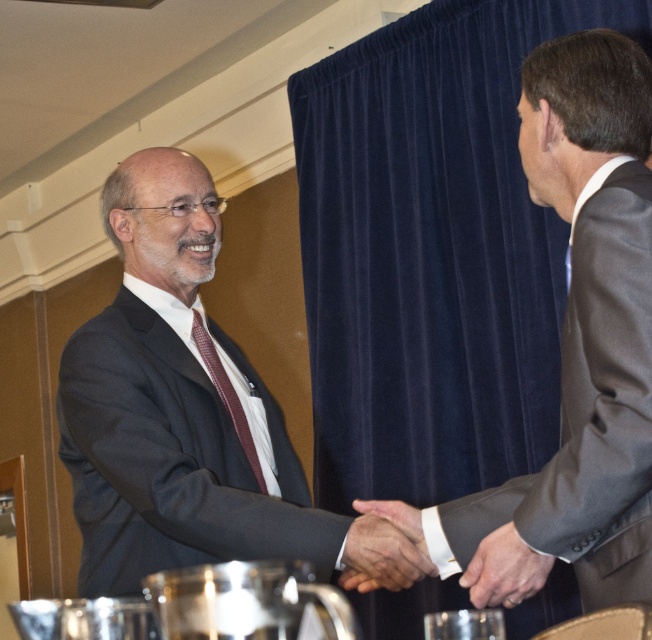
Question: Which point appears closest to the camera in this image?

Choices:
 (A) (649, 448)
 (B) (203, 512)
 (C) (507, 104)

Answer: (A)

Question: Can you confirm if velvet blue curtain at upper center is thinner than white leather hand at center?

Choices:
 (A) no
 (B) yes

Answer: (A)

Question: Which of the following is the farthest from the observer?

Choices:
 (A) (430, 273)
 (B) (576, 557)

Answer: (A)

Question: Is gray pinstripe suit at right to the left of white leather hand at center from the viewer's perspective?

Choices:
 (A) yes
 (B) no

Answer: (B)

Question: Estimate the real-world distances between objects in this image. Which object is closer to the matte black suit at center?

Choices:
 (A) maroon textured tie at center
 (B) velvet blue curtain at upper center
 (C) smooth leather hand at center
 (D) gray pinstripe suit at right

Answer: (A)

Question: From the image, what is the correct spatial relationship of gray pinstripe suit at right in relation to white leather hand at center?

Choices:
 (A) right
 (B) left

Answer: (A)